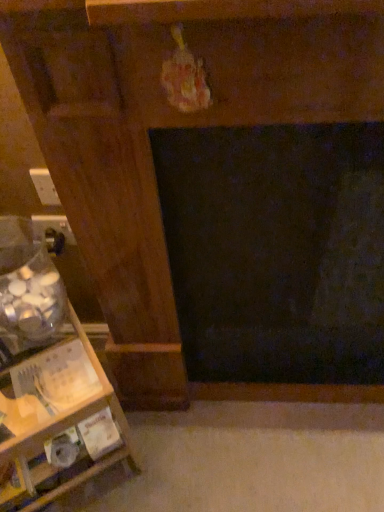
Question: From a real-world perspective, relative to white plastic electric outlet at left, which is the first electric outlet from front to back, is matte black outlet at lower left, which ranks as the first electric outlet in bottom-to-top order, vertically above or below?

Choices:
 (A) above
 (B) below

Answer: (B)

Question: Considering the positions of point (61, 215) and point (36, 179), is point (61, 215) closer or farther from the camera than point (36, 179)?

Choices:
 (A) closer
 (B) farther

Answer: (B)

Question: Which of these objects is positioned closest to the white plastic electric outlet at left, which is the second electric outlet in back-to-front order?

Choices:
 (A) wooden shelf at left
 (B) matte black outlet at lower left, which ranks as the first electric outlet in bottom-to-top order

Answer: (B)

Question: Which of these objects is positioned closest to the matte black outlet at lower left, which ranks as the first electric outlet in bottom-to-top order?

Choices:
 (A) white plastic electric outlet at left, placed as the first electric outlet when sorted from top to bottom
 (B) wooden shelf at left

Answer: (A)